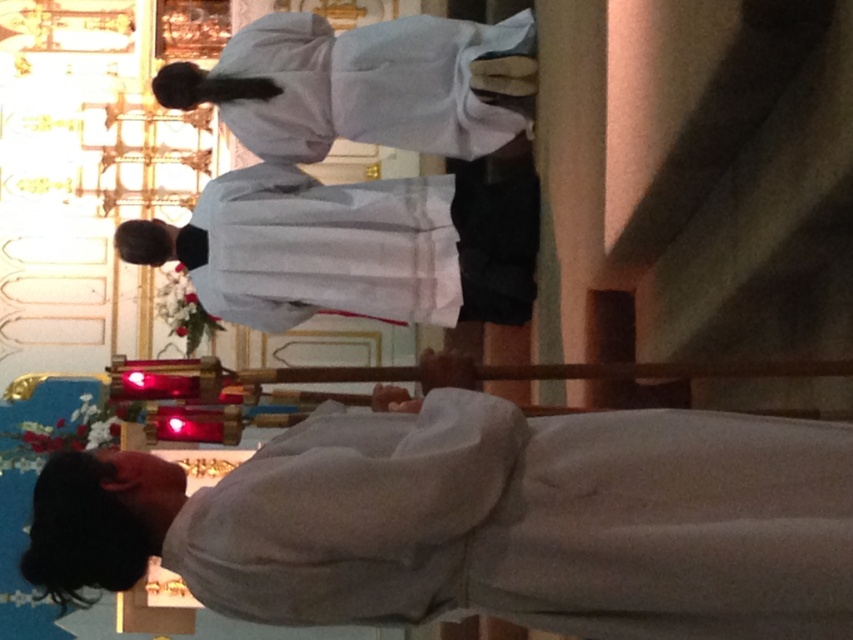
Question: Does white soft cloth at lower center come behind white matte robe at center?

Choices:
 (A) no
 (B) yes

Answer: (A)

Question: Considering the real-world distances, which object is closest to the white matte robe at center?

Choices:
 (A) white matte robe at upper center
 (B) white soft cloth at lower center

Answer: (A)

Question: Is white soft cloth at lower center to the left of white matte robe at center from the viewer's perspective?

Choices:
 (A) yes
 (B) no

Answer: (B)

Question: Does white soft cloth at lower center appear on the left side of white matte robe at upper center?

Choices:
 (A) yes
 (B) no

Answer: (B)

Question: Among these points, which one is farthest from the camera?

Choices:
 (A) (291, 324)
 (B) (247, 486)

Answer: (A)

Question: Considering the real-world distances, which object is farthest from the white soft cloth at lower center?

Choices:
 (A) white matte robe at center
 (B) white matte robe at upper center

Answer: (B)